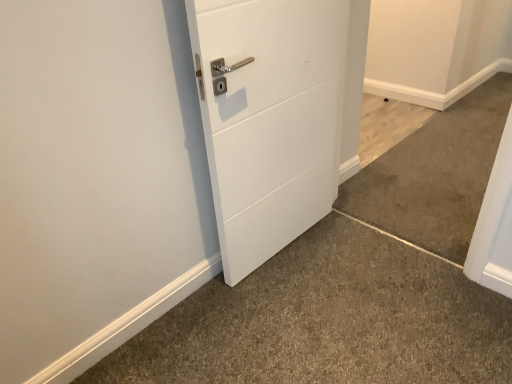
Question: Is light brown wood floor at lower right, positioned as the first concrete in top-to-bottom order, to the left or to the right of brown carpet at lower right, which appears as the second concrete when ordered from the bottom, in the image?

Choices:
 (A) right
 (B) left

Answer: (B)

Question: From a real-world perspective, is light brown wood floor at lower right, positioned as the 3th concrete in bottom-to-top order, above or below brown carpet at lower right, which ranks as the second concrete in top-to-bottom order?

Choices:
 (A) below
 (B) above

Answer: (A)

Question: Which object is the closest to the white matte door at center?

Choices:
 (A) gray carpet at lower left, positioned as the third concrete in top-to-bottom order
 (B) light brown wood floor at lower right, positioned as the 3th concrete in bottom-to-top order
 (C) brown carpet at lower right, which ranks as the second concrete in top-to-bottom order

Answer: (A)

Question: Estimate the real-world distances between objects in this image. Which object is farther from the light brown wood floor at lower right, positioned as the first concrete in top-to-bottom order?

Choices:
 (A) brown carpet at lower right, which ranks as the second concrete in top-to-bottom order
 (B) gray carpet at lower left, positioned as the third concrete in top-to-bottom order
 (C) white matte door at center

Answer: (B)